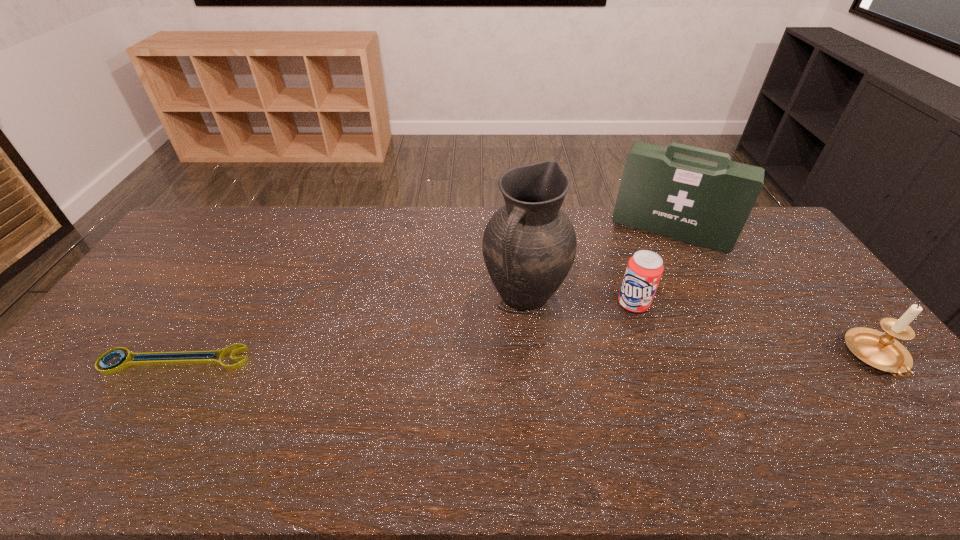
Identify the location of wrench. The image size is (960, 540). (199, 357).

Image resolution: width=960 pixels, height=540 pixels. What are the coordinates of `the shortest object` in the screenshot? It's located at (199, 357).

This screenshot has width=960, height=540. In order to click on the rightmost object in this screenshot , I will do `click(877, 349)`.

This screenshot has width=960, height=540. Find the location of `soda can`. soda can is located at coordinates pyautogui.click(x=644, y=270).

I want to click on the tallest object, so [x=529, y=245].

Identify the location of the second object from left to right. Image resolution: width=960 pixels, height=540 pixels. click(x=529, y=245).

You are a GUI agent. You are given a task and a screenshot of the screen. Output one action in this format:
    pyautogui.click(x=<x>, y=<y>)
    Task: Click on the first-aid kit
    Image resolution: width=960 pixels, height=540 pixels.
    Given the screenshot: What is the action you would take?
    pyautogui.click(x=704, y=203)

Identify the location of the farthest object. Image resolution: width=960 pixels, height=540 pixels. (704, 203).

The height and width of the screenshot is (540, 960). In order to click on vacant space located 0.150m on the right of the wrench in this screenshot , I will do `click(303, 360)`.

You are a GUI agent. You are given a task and a screenshot of the screen. Output one action in this format:
    pyautogui.click(x=<x>, y=<y>)
    Task: Click on the vacant space located with a handle on the side of the candle holder
    
    Given the screenshot: What is the action you would take?
    pyautogui.click(x=915, y=404)